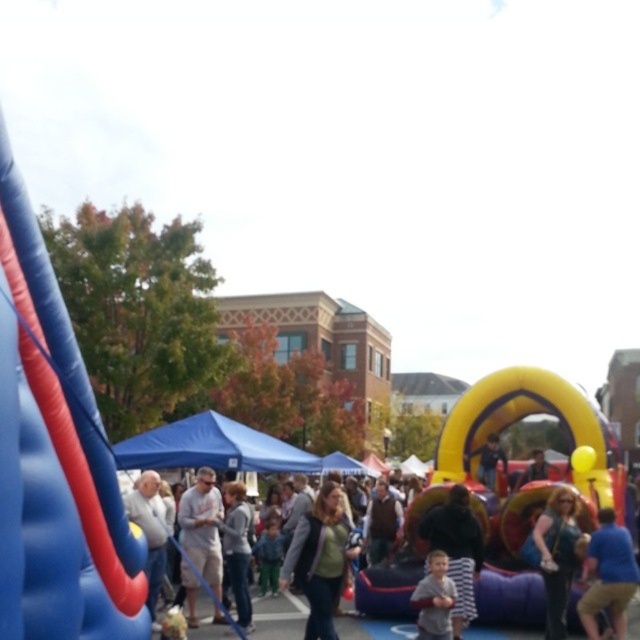
You are a photographer standing at the edge of the scene wanting to capture both the striped fabric shirt at center and the gray cotton shirt at center in a single photo. What is the minimum distance you need to move backward to ensure both shirts are fully visible in your camera frame?

The striped fabric shirt at center and the gray cotton shirt at center are 2.06 meters apart. To capture both in a single photo, you need to move back at least 2.06 meters to ensure the entire distance between them fits within the camera frame.

You are at the event and want to take a photo of both the blue and red bouncy castle on the left and the yellow inflatable archway on the right. To ensure both are in the frame, should you move closer to or farther from the two points marked as point (476, 544) and point (440, 556)?

Since point (476, 544) is behind point (440, 556), you should move closer to both points to ensure both the blue and red bouncy castle on the left and the yellow inflatable archway on the right are in the frame.

You are a photographer at the event and want to capture both the green fabric jacket at center and the shiny blue purse at center in a single photo. Which object should you focus on first if you want to ensure both are clearly visible in the frame?

You should focus on the green fabric jacket at center first because it is bigger than the shiny blue purse at center, making it easier to ensure both are in focus and visible.